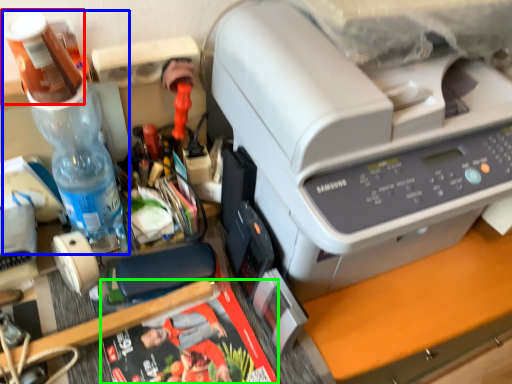
Question: Which object is the closest to the stationery (highlighted by a red box)? Choose among these: bottle (highlighted by a blue box) or magazine (highlighted by a green box).

Choices:
 (A) bottle
 (B) magazine

Answer: (A)